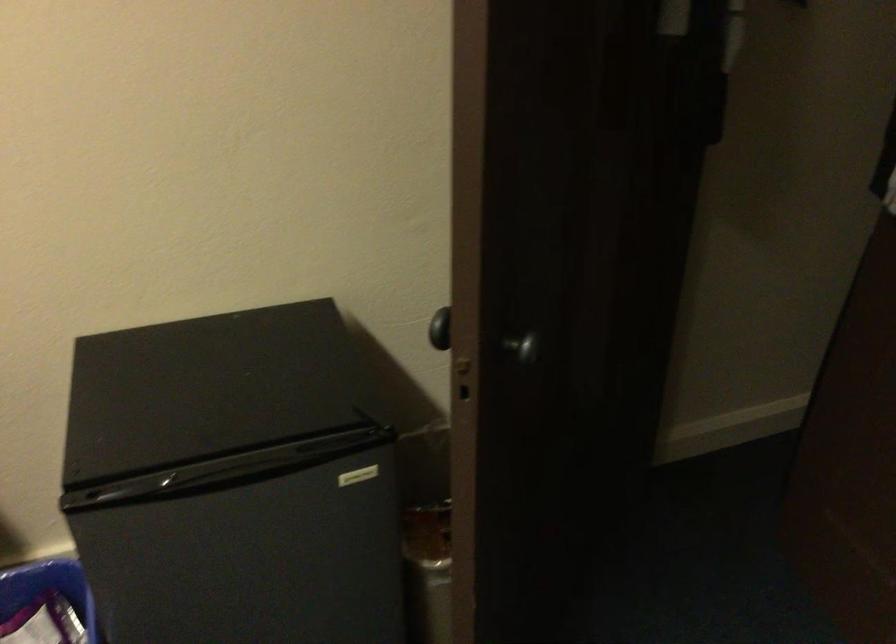
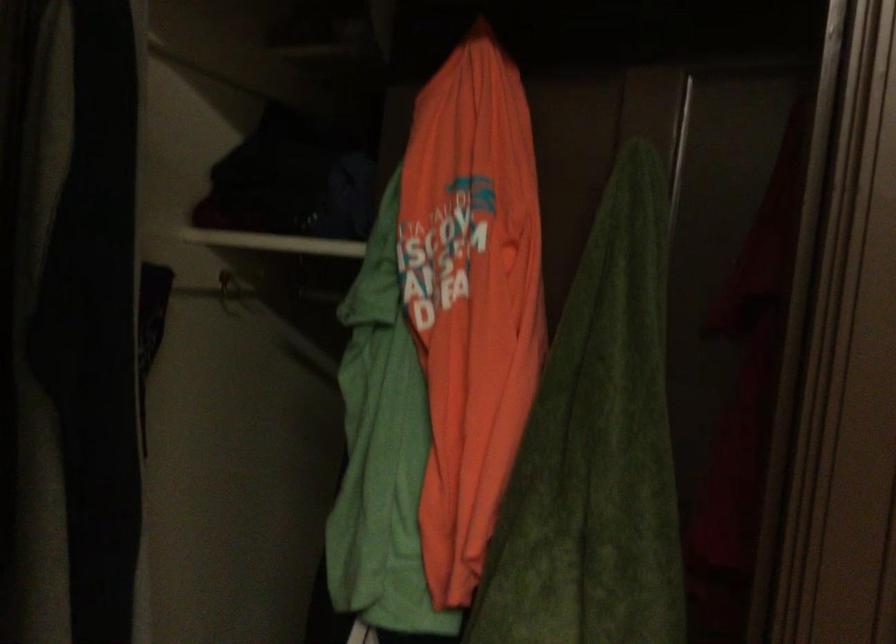
Question: The camera is either moving clockwise (left) or counter-clockwise (right) around the object. The first image is from the beginning of the video and the second image is from the end. Is the camera moving left or right when shooting the video?

Choices:
 (A) Left
 (B) Right

Answer: (A)